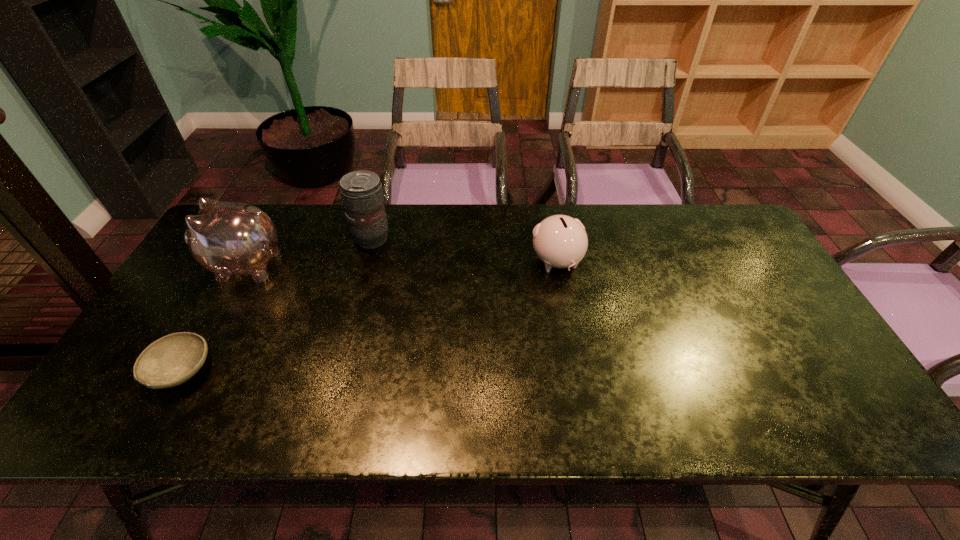
Where is `vacant space that satisfies the following two spatial constraints: 1. on the front side of the right piggy bank; 2. on the front facing side of the taller piggy bank`? This screenshot has height=540, width=960. vacant space that satisfies the following two spatial constraints: 1. on the front side of the right piggy bank; 2. on the front facing side of the taller piggy bank is located at coordinates (558, 265).

Find the location of `vacant space that satisfies the following two spatial constraints: 1. on the front facing side of the taller piggy bank; 2. on the front side of the nearest object`. vacant space that satisfies the following two spatial constraints: 1. on the front facing side of the taller piggy bank; 2. on the front side of the nearest object is located at coordinates (188, 372).

Image resolution: width=960 pixels, height=540 pixels. What are the coordinates of `vacant space that satisfies the following two spatial constraints: 1. on the side of the third object from left to right where the control switches are located; 2. on the front side of the bowl` in the screenshot? It's located at (337, 372).

I want to click on blank space that satisfies the following two spatial constraints: 1. on the side of the third object from left to right where the control switches are located; 2. on the front side of the bowl, so click(x=337, y=372).

I want to click on free location that satisfies the following two spatial constraints: 1. on the back side of the nearest object; 2. on the right side of the right piggy bank, so click(242, 262).

You are a GUI agent. You are given a task and a screenshot of the screen. Output one action in this format:
    pyautogui.click(x=<x>, y=<y>)
    Task: Click on the free region that satisfies the following two spatial constraints: 1. on the back side of the right piggy bank; 2. on the side of the third object from left to right where the control switches are located
    The image size is (960, 540).
    Given the screenshot: What is the action you would take?
    pyautogui.click(x=553, y=239)